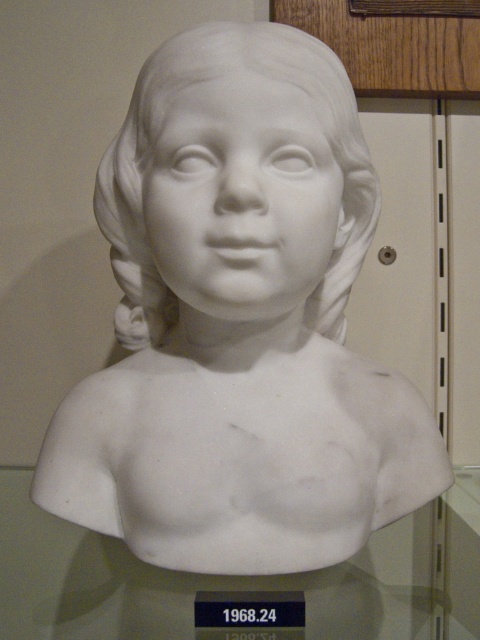
Is transparent glass bust at center below white marble bust at center?

Yes, transparent glass bust at center is below white marble bust at center.

This screenshot has height=640, width=480. In order to click on transparent glass bust at center in this screenshot , I will do click(x=233, y=579).

Which is behind, point (0, 561) or point (186, 80)?

The point (0, 561) is behind.

Image resolution: width=480 pixels, height=640 pixels. I want to click on transparent glass bust at center, so click(x=233, y=579).